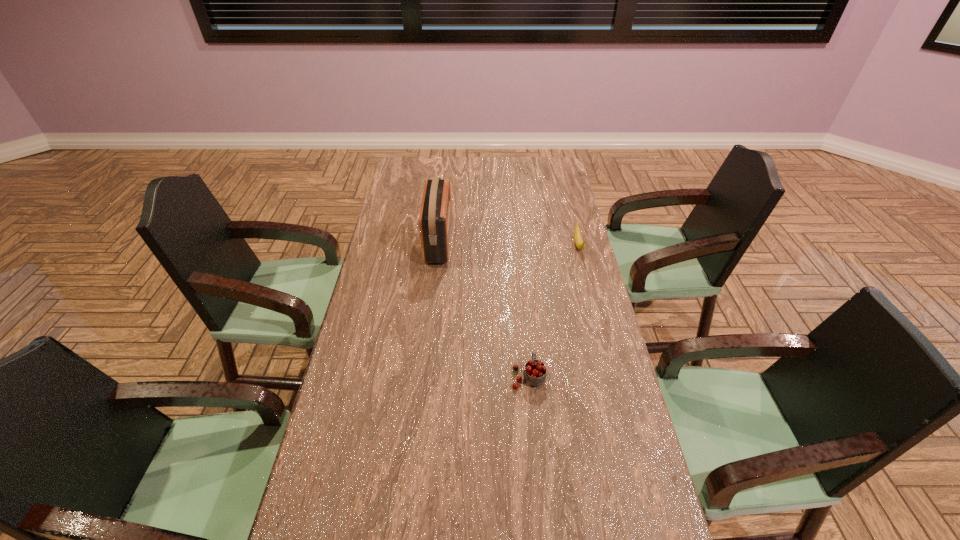
Identify the location of free location located 0.130m at the stem of the shortest object. (588, 282).

Locate an element on the screen. The width and height of the screenshot is (960, 540). object that is at the right edge is located at coordinates (579, 242).

In the image, there is a desktop. Where is `blank space at the far edge`? blank space at the far edge is located at coordinates tap(512, 158).

Locate an element on the screen. free space at the left edge is located at coordinates (402, 266).

In the image, there is a desktop. Where is `free region at the right edge`? This screenshot has height=540, width=960. free region at the right edge is located at coordinates (620, 531).

Locate an element on the screen. The height and width of the screenshot is (540, 960). blank space at the far right corner is located at coordinates (543, 163).

Locate an element on the screen. This screenshot has height=540, width=960. empty location between the banana and the radio receiver is located at coordinates (509, 244).

Find the location of `free point between the shortest object and the nearest object`. free point between the shortest object and the nearest object is located at coordinates (553, 310).

Locate an element on the screen. The image size is (960, 540). free space between the tallest object and the rightmost object is located at coordinates (509, 244).

Where is `empty space that is in between the second object from left to right and the leftmost object`? empty space that is in between the second object from left to right and the leftmost object is located at coordinates (484, 309).